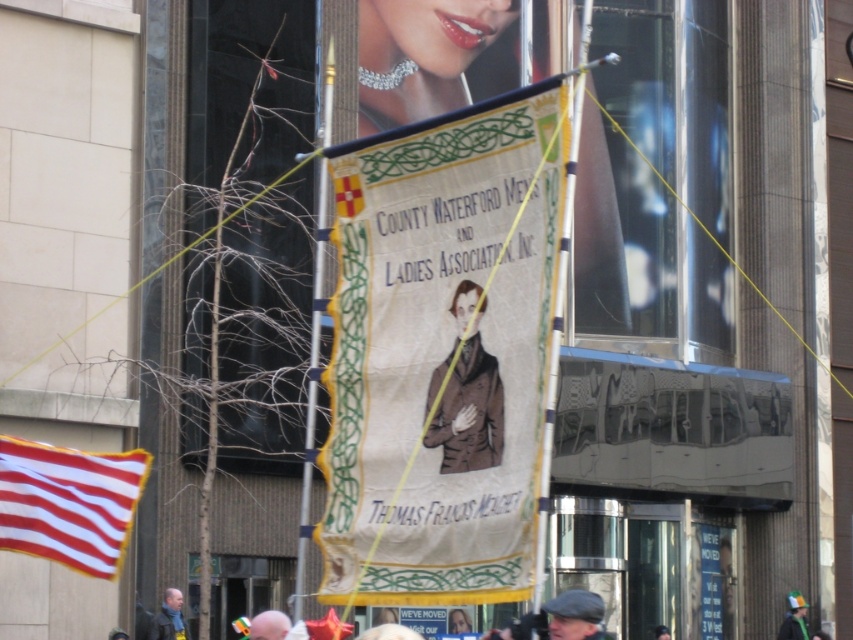
Does red and white striped fabric at left have a greater width compared to green fabric hat at center?

No, red and white striped fabric at left is not wider than green fabric hat at center.

Looking at this image, is red and white striped fabric at left bigger than green fabric hat at center?

Yes, red and white striped fabric at left is bigger than green fabric hat at center.

Who is more distant from viewer, (73, 458) or (798, 593)?

Point (798, 593)

At what (x,y) coordinates should I click in order to perform the action: click on red and white striped fabric at left. Please return your answer as a coordinate pair (x, y). Image resolution: width=853 pixels, height=640 pixels. Looking at the image, I should click on (68, 502).

Does brown textured coat at center have a greater height compared to light brown hair at lower center?

No, brown textured coat at center is not taller than light brown hair at lower center.

Can you confirm if brown textured coat at center is positioned to the right of light brown hair at lower center?

Indeed, brown textured coat at center is positioned on the right side of light brown hair at lower center.

Is point (442, 435) positioned behind point (277, 616)?

No, (442, 435) is in front of (277, 616).

Image resolution: width=853 pixels, height=640 pixels. Find the location of `brown textured coat at center`. brown textured coat at center is located at coordinates (469, 410).

Is point (788, 605) positioned behind point (252, 636)?

Yes, point (788, 605) is behind point (252, 636).

What do you see at coordinates (793, 618) in the screenshot? I see `green fabric hat at center` at bounding box center [793, 618].

The height and width of the screenshot is (640, 853). What are the coordinates of `green fabric hat at center` in the screenshot? It's located at (793, 618).